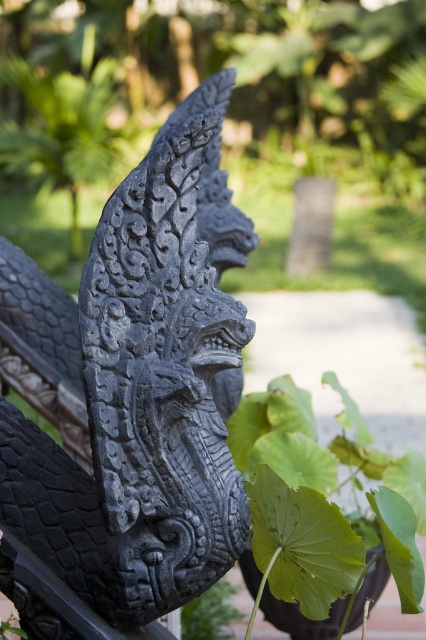
Is black stone dragon head at center shorter than green leafy plant at lower center?

Incorrect, black stone dragon head at center's height does not fall short of green leafy plant at lower center's.

In order to click on black stone dragon head at center in this screenshot , I will do `click(138, 384)`.

At what (x,y) coordinates should I click in order to perform the action: click on black stone dragon head at center. Please return your answer as a coordinate pair (x, y). The height and width of the screenshot is (640, 426). Looking at the image, I should click on (138, 384).

This screenshot has height=640, width=426. I want to click on black stone dragon head at center, so click(138, 384).

Can you confirm if green leafy plant at lower right is smaller than green leafy plant at lower center?

Actually, green leafy plant at lower right might be larger than green leafy plant at lower center.

The height and width of the screenshot is (640, 426). What do you see at coordinates (322, 504) in the screenshot?
I see `green leafy plant at lower right` at bounding box center [322, 504].

Between point (319, 522) and point (206, 605), which one is positioned behind?

The point (206, 605) is more distant.

I want to click on green leafy plant at lower right, so click(x=322, y=504).

Is black stone dragon head at center above green leafy plant at lower right?

Indeed, black stone dragon head at center is positioned over green leafy plant at lower right.

Which is in front, point (39, 637) or point (270, 595)?

Point (39, 637) is in front.

You are a GUI agent. You are given a task and a screenshot of the screen. Output one action in this format:
    pyautogui.click(x=<x>, y=<y>)
    Task: Click on the black stone dragon head at center
    
    Given the screenshot: What is the action you would take?
    pyautogui.click(x=138, y=384)